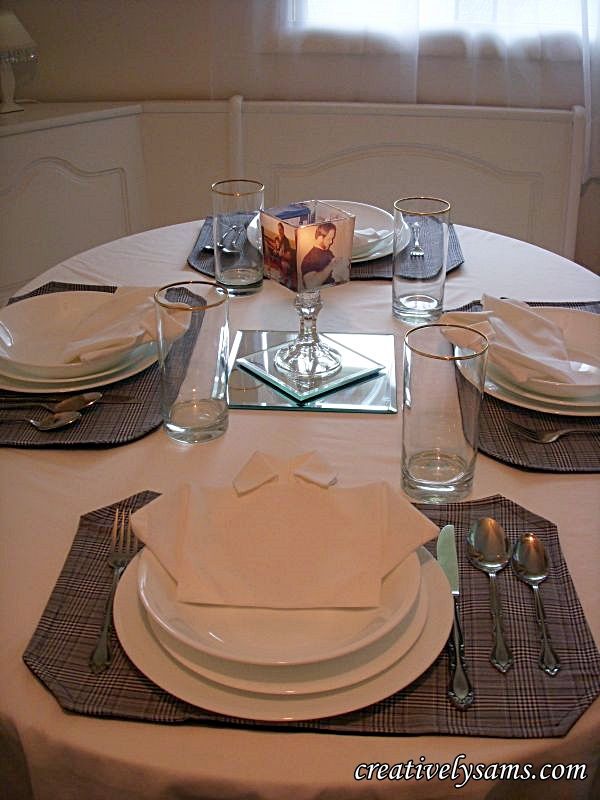
Identify the location of dinner plates. This screenshot has width=600, height=800. (426, 640), (498, 393), (370, 206), (38, 390).